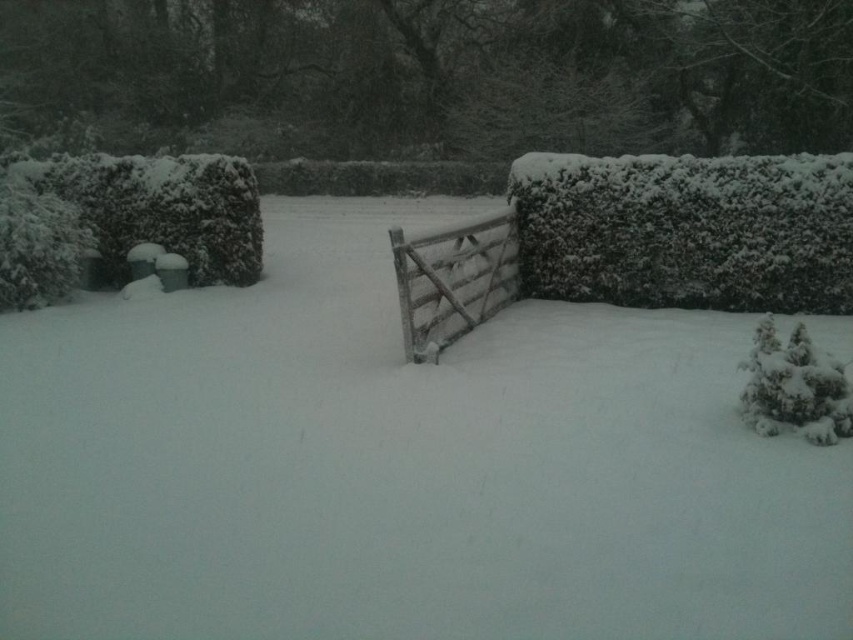
Question: Which of the following is the farthest from the observer?

Choices:
 (A) (433, 349)
 (B) (830, 368)

Answer: (A)

Question: Which is farther from the snow-covered hedge at right?

Choices:
 (A) wooden gate at center
 (B) snow-covered bush at lower right

Answer: (B)

Question: Where is snow-covered hedge at right located in relation to snow-covered bush at lower right in the image?

Choices:
 (A) left
 (B) right

Answer: (B)

Question: Can you confirm if snow-covered hedge at right is positioned to the right of wooden gate at center?

Choices:
 (A) no
 (B) yes

Answer: (B)

Question: Is snow-covered hedge at right bigger than snow-covered bush at lower right?

Choices:
 (A) yes
 (B) no

Answer: (A)

Question: Which object is farther from the camera taking this photo?

Choices:
 (A) wooden gate at center
 (B) snow-covered hedge at right
 (C) snow-covered bush at lower right

Answer: (B)